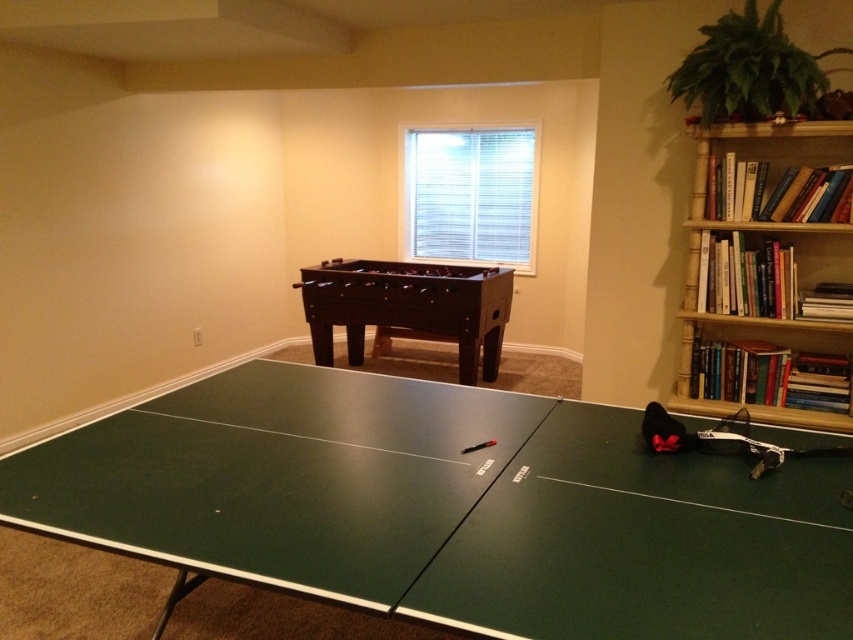
Is green matte ping pong table at center smaller than dark brown wooden foosball table at center?

No.

Is point (415, 384) farther from camera compared to point (422, 289)?

That is False.

The image size is (853, 640). Describe the element at coordinates (450, 508) in the screenshot. I see `green matte ping pong table at center` at that location.

Identify the location of green matte ping pong table at center. Image resolution: width=853 pixels, height=640 pixels. (450, 508).

Does point (840, 262) come farther from viewer compared to point (462, 275)?

No, (840, 262) is closer to viewer.

Between wooden bookshelf at right and dark brown wooden foosball table at center, which one has less height?

dark brown wooden foosball table at center

Where is `wooden bookshelf at right`? The height and width of the screenshot is (640, 853). wooden bookshelf at right is located at coordinates (762, 237).

Who is lower down, green matte ping pong table at center or wooden bookshelf at right?

Positioned lower is green matte ping pong table at center.

Can you confirm if green matte ping pong table at center is positioned to the right of wooden bookshelf at right?

Incorrect, green matte ping pong table at center is not on the right side of wooden bookshelf at right.

Does point (438, 588) come behind point (733, 320)?

That is False.

Where is `green matte ping pong table at center`? The width and height of the screenshot is (853, 640). green matte ping pong table at center is located at coordinates (450, 508).